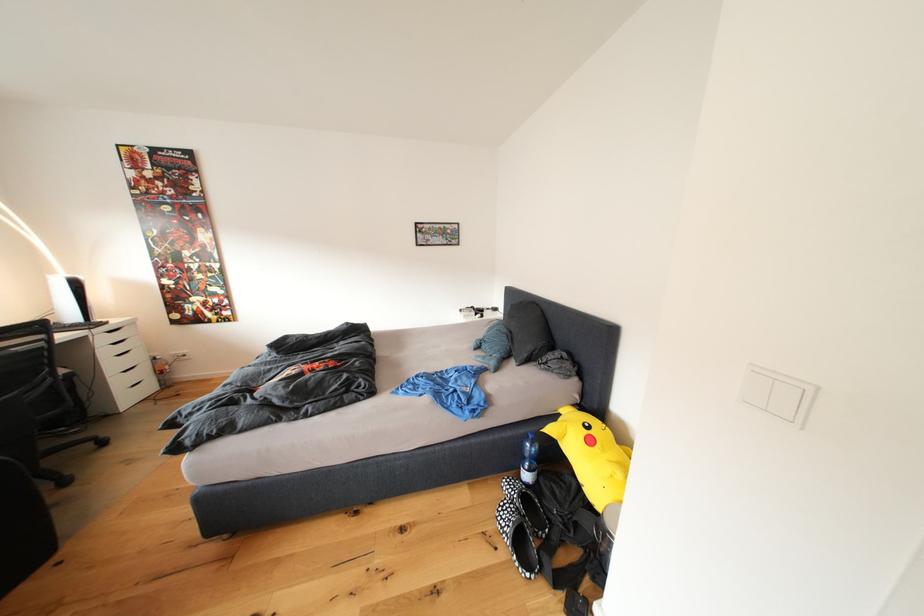
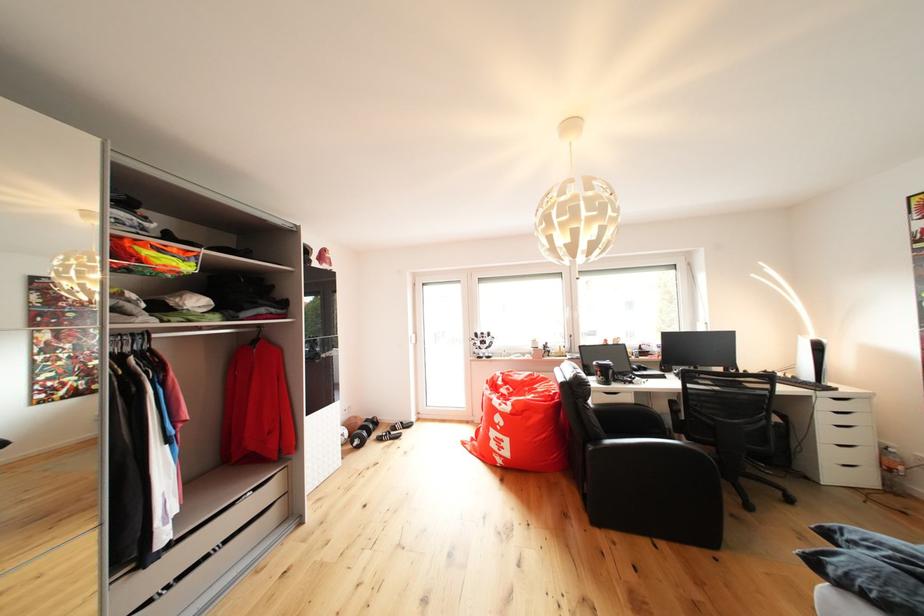
In the second image, find the point that corresponds to point 147,363 in the first image.

(869, 444)